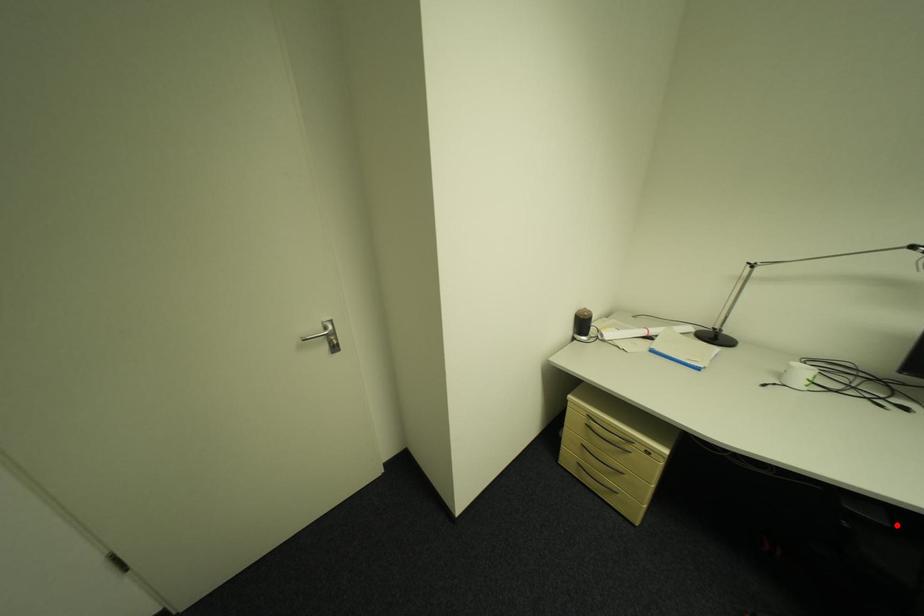
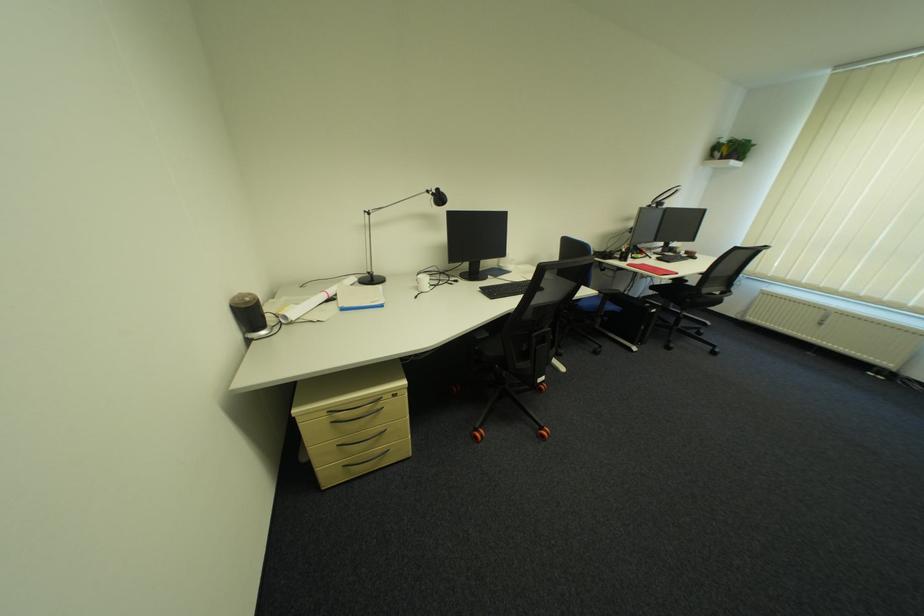
Find the pixel in the second image that matches the highlighted location in the first image.

(497, 334)